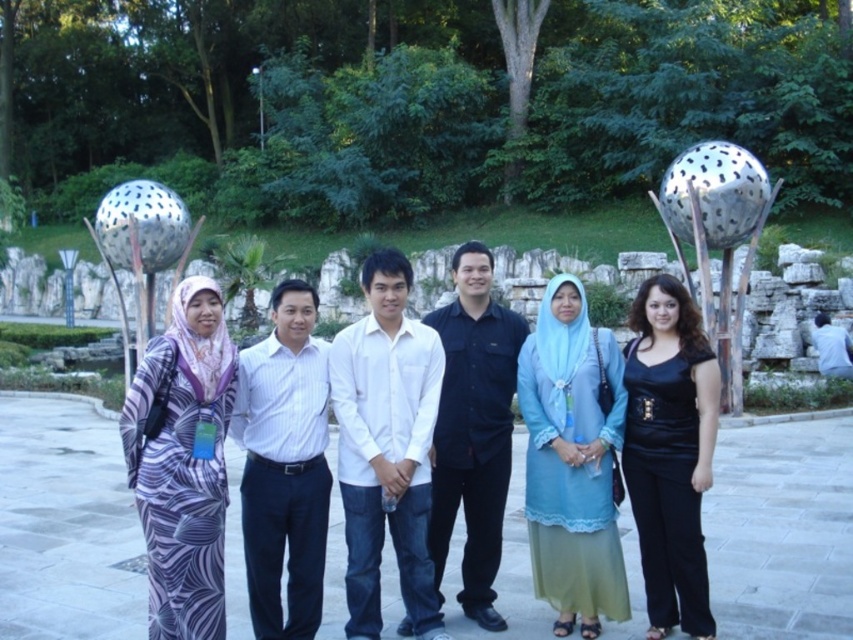
Question: Is white striped shirt at center thinner than black leather pants at right?

Choices:
 (A) no
 (B) yes

Answer: (A)

Question: Can you confirm if black cotton shirt at center is positioned to the left of metallic perforated sphere at upper left?

Choices:
 (A) yes
 (B) no

Answer: (B)

Question: Among these points, which one is farthest from the camera?

Choices:
 (A) (825, 365)
 (B) (286, 436)
 (C) (718, 216)
 (D) (157, 264)

Answer: (A)

Question: Which point is farther to the camera?

Choices:
 (A) (701, 397)
 (B) (187, 342)
 (C) (170, 241)

Answer: (C)

Question: Which of the following is the farthest from the observer?

Choices:
 (A) white cotton shirt at center
 (B) white cotton shirt at right
 (C) black leather pants at right
 (D) purple printed dress at left

Answer: (B)

Question: Considering the relative positions of black cotton shirt at center and white cotton shirt at right in the image provided, where is black cotton shirt at center located with respect to white cotton shirt at right?

Choices:
 (A) above
 (B) below

Answer: (A)